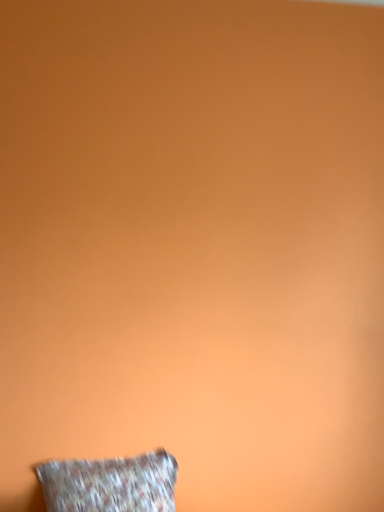
Image resolution: width=384 pixels, height=512 pixels. Describe the element at coordinates (110, 484) in the screenshot. I see `fluffy fabric pillow at lower left` at that location.

Measure the distance between point (61, 481) and camera.

The depth of point (61, 481) is 5.22 feet.

Where is `fluffy fabric pillow at lower left`? The image size is (384, 512). fluffy fabric pillow at lower left is located at coordinates (110, 484).

Locate an element on the screen. The width and height of the screenshot is (384, 512). fluffy fabric pillow at lower left is located at coordinates (110, 484).